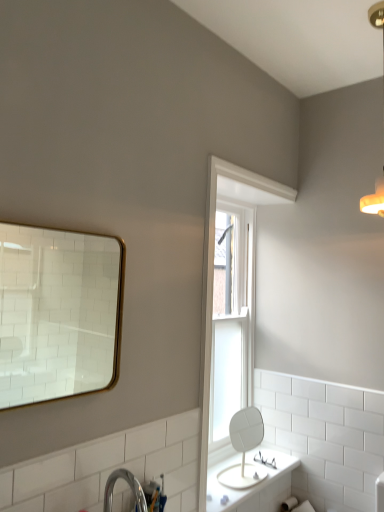
Question: From a real-world perspective, does clear glass window at center sit lower than white painted wood window frame at upper center?

Choices:
 (A) yes
 (B) no

Answer: (A)

Question: From the image's perspective, is clear glass window at center over white painted wood window frame at upper center?

Choices:
 (A) yes
 (B) no

Answer: (B)

Question: Is clear glass window at center bigger than white painted wood window frame at upper center?

Choices:
 (A) yes
 (B) no

Answer: (A)

Question: Is white painted wood window frame at upper center surrounded by clear glass window at center?

Choices:
 (A) yes
 (B) no

Answer: (B)

Question: Is clear glass window at center touching white painted wood window frame at upper center?

Choices:
 (A) yes
 (B) no

Answer: (B)

Question: From the image's perspective, is gold-framed mirror at upper left, the 2th mirror in the bottom-to-top sequence, above or below clear glass window at center?

Choices:
 (A) above
 (B) below

Answer: (A)

Question: In the image, is gold-framed mirror at upper left, the first mirror from the top, positioned in front of or behind clear glass window at center?

Choices:
 (A) front
 (B) behind

Answer: (A)

Question: Is gold-framed mirror at upper left, the first mirror from the top, wider or thinner than clear glass window at center?

Choices:
 (A) thin
 (B) wide

Answer: (A)

Question: In terms of height, does gold-framed mirror at upper left, arranged as the first mirror when viewed from the front, look taller or shorter compared to clear glass window at center?

Choices:
 (A) short
 (B) tall

Answer: (A)

Question: Is point (274, 467) closer or farther from the camera than point (231, 309)?

Choices:
 (A) closer
 (B) farther

Answer: (A)

Question: In terms of height, does clear plastic glasses at center look taller or shorter compared to clear glass window at center?

Choices:
 (A) short
 (B) tall

Answer: (A)

Question: Would you say clear plastic glasses at center is to the left or to the right of clear glass window at center in the picture?

Choices:
 (A) left
 (B) right

Answer: (B)

Question: From a real-world perspective, is clear plastic glasses at center physically located above or below clear glass window at center?

Choices:
 (A) below
 (B) above

Answer: (A)

Question: In terms of height, does warm matte light fixture at upper right look taller or shorter compared to white painted wood window frame at upper center?

Choices:
 (A) tall
 (B) short

Answer: (B)

Question: From the image's perspective, is warm matte light fixture at upper right located above or below white painted wood window frame at upper center?

Choices:
 (A) below
 (B) above

Answer: (B)